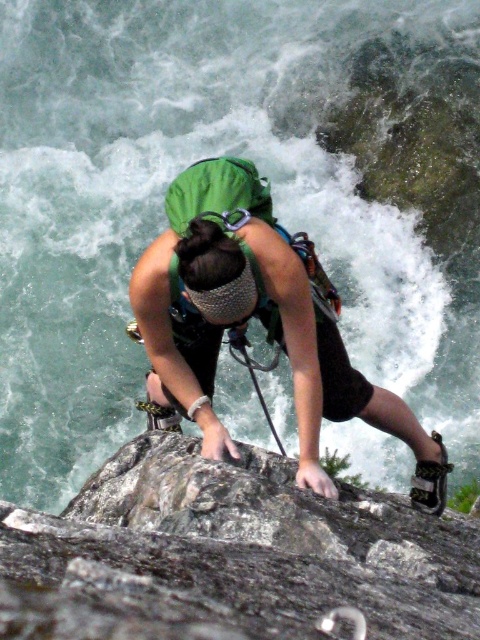
Between gray rough rock at center and green fabric helmet at center, which one is positioned higher?

green fabric helmet at center

Can you confirm if gray rough rock at center is positioned to the left of green fabric helmet at center?

In fact, gray rough rock at center is to the right of green fabric helmet at center.

Who is more distant from viewer, (233, 490) or (164, 246)?

The point (164, 246) is more distant.

This screenshot has height=640, width=480. Identify the location of gray rough rock at center. (229, 556).